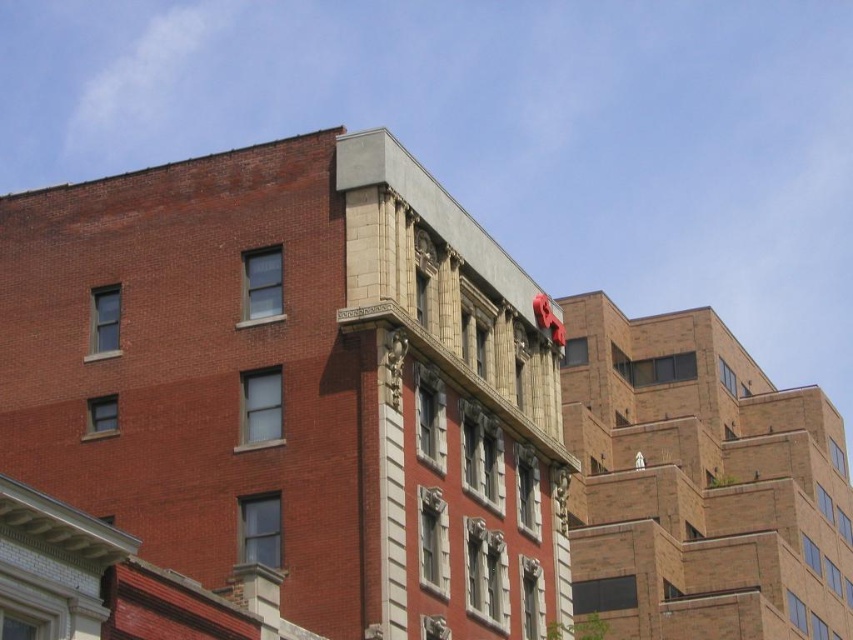
How far apart are smooth concrete peak at upper center and brown brick building at upper right?

The distance of smooth concrete peak at upper center from brown brick building at upper right is 18.84 meters.

Which is in front, point (33, 356) or point (747, 410)?

Point (33, 356) is more forward.

Find the location of a particular element. The height and width of the screenshot is (640, 853). smooth concrete peak at upper center is located at coordinates (294, 385).